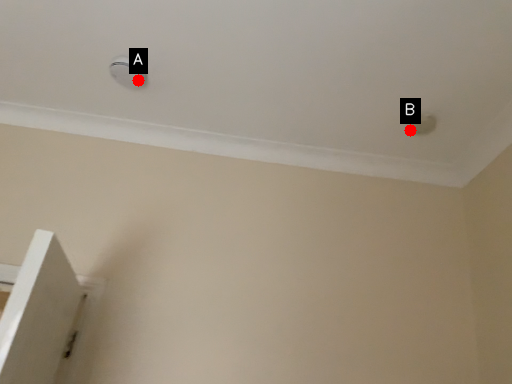
Question: Two points are circled on the image, labeled by A and B beside each circle. Which point is closer to the camera?

Choices:
 (A) A is closer
 (B) B is closer

Answer: (A)